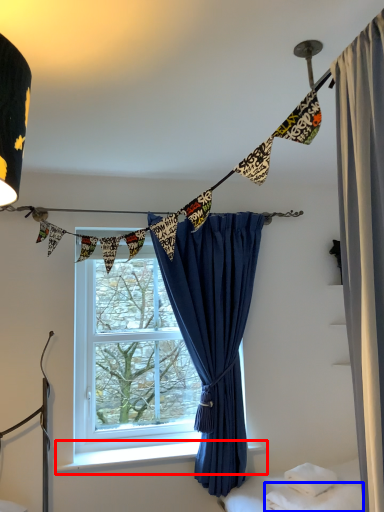
Question: Among these objects, which one is nearest to the camera, window sill (highlighted by a red box) or sheet (highlighted by a blue box)?

Choices:
 (A) window sill
 (B) sheet

Answer: (B)